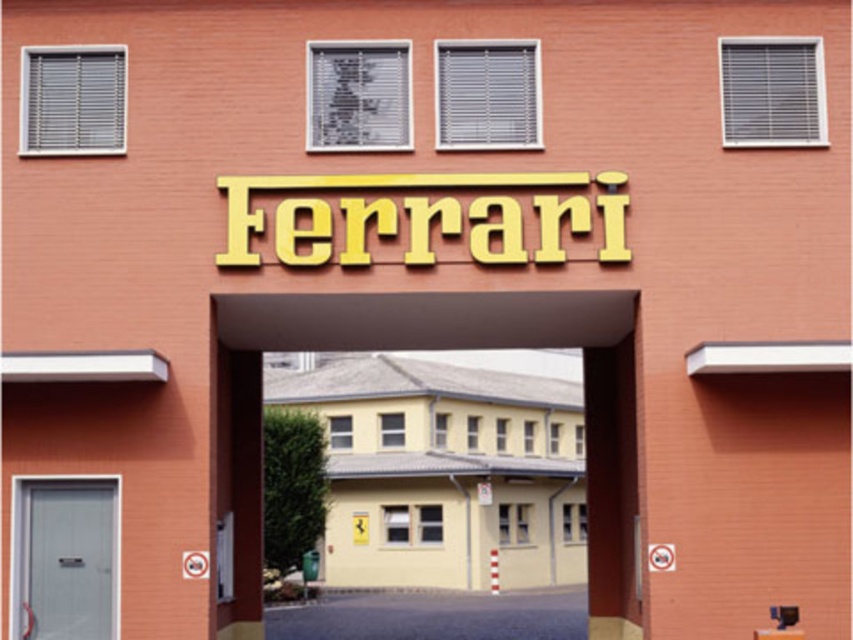
Question: Where is yellow matte building at center located in relation to metallic gray door at lower left in the image?

Choices:
 (A) above
 (B) below

Answer: (A)

Question: Considering the relative positions of yellow matte building at center and metallic gray door at lower left in the image provided, where is yellow matte building at center located with respect to metallic gray door at lower left?

Choices:
 (A) right
 (B) left

Answer: (A)

Question: Does yellow matte building at center appear on the left side of metallic gray door at lower left?

Choices:
 (A) no
 (B) yes

Answer: (A)

Question: Which point appears farthest from the camera in this image?

Choices:
 (A) (115, 541)
 (B) (242, 317)

Answer: (B)

Question: Which point is closer to the camera?

Choices:
 (A) metallic gray door at lower left
 (B) yellow matte building at center

Answer: (A)